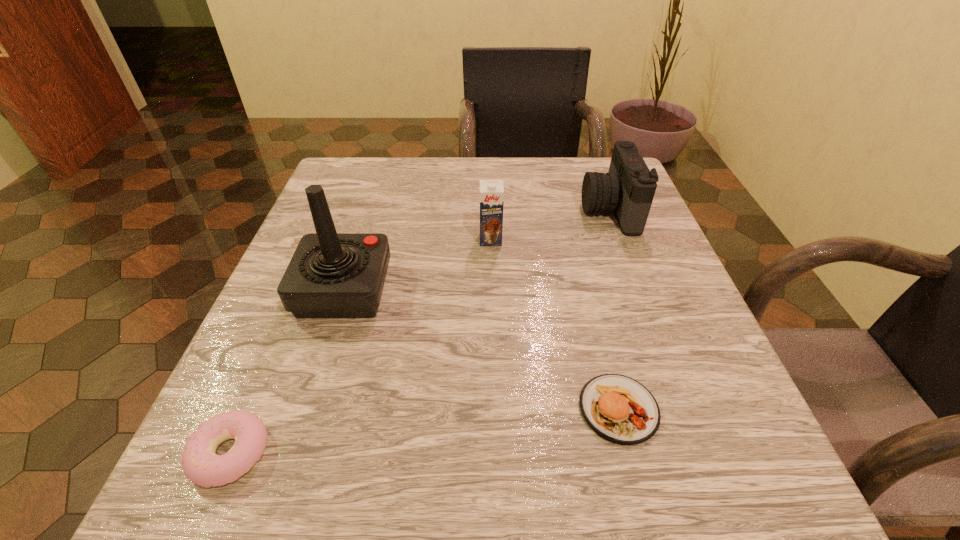
Find the location of `the third nearest object`. the third nearest object is located at coordinates (331, 275).

Locate an element on the screen. joystick is located at coordinates (331, 275).

This screenshot has width=960, height=540. Identify the location of chocolate milk. (491, 191).

In order to click on camera in this screenshot , I will do pyautogui.click(x=628, y=189).

This screenshot has height=540, width=960. I want to click on the second shortest object, so click(618, 408).

Find the location of a particular element. Image resolution: width=960 pixels, height=540 pixels. the shortest object is located at coordinates (201, 465).

This screenshot has width=960, height=540. Identify the location of vacant area situated on the front-facing side of the tallest object. (489, 289).

This screenshot has height=540, width=960. Identify the location of free space located 0.110m on the front label of the chocolate milk. (492, 285).

The image size is (960, 540). Identify the location of free region located at the lens of the camera. (546, 210).

Find the location of a particular element. free space located 0.260m at the lens of the camera is located at coordinates (464, 210).